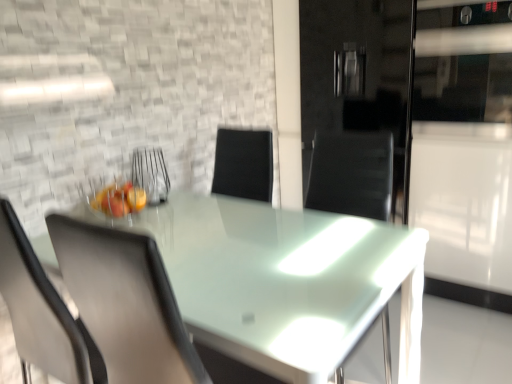
This screenshot has width=512, height=384. I want to click on vacant region above transparent glass table at center (from a real-world perspective), so click(250, 254).